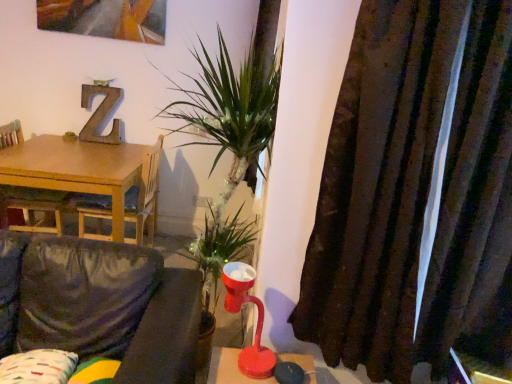
Question: In the image, is wooden table at left on the left side or the right side of matte red table lamp at center?

Choices:
 (A) right
 (B) left

Answer: (B)

Question: Do you think wooden table at left is within matte red table lamp at center, or outside of it?

Choices:
 (A) outside
 (B) inside

Answer: (A)

Question: Based on their relative distances, which object is farther from the wooden table at left?

Choices:
 (A) wooden chair at left, the 1th chair from the left
 (B) patterned fabric pillow at lower left
 (C) light brown wood chair at left, the second chair from the left
 (D) velvet dark grey couch at lower left
 (E) brown textured curtain at right

Answer: (E)

Question: Which object is the closest to the wooden table at left?

Choices:
 (A) matte red table lamp at center
 (B) wooden chair at left, placed as the second chair when sorted from right to left
 (C) velvet dark grey couch at lower left
 (D) light brown wood chair at left, marked as the 1th chair in a right-to-left arrangement
 (E) brown textured curtain at right

Answer: (D)